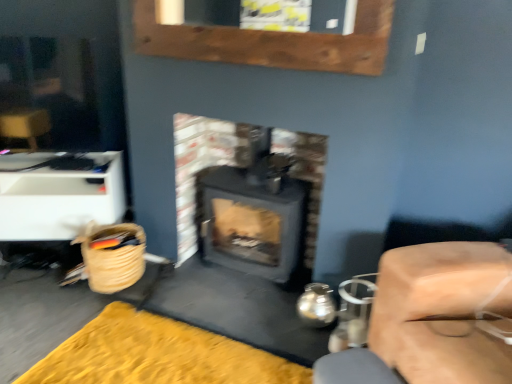
At what (x,y) coordinates should I click in order to perform the action: click on free space to the left of matte black wood burning stove at center. Please return your answer as a coordinate pair (x, y). The height and width of the screenshot is (384, 512). Looking at the image, I should click on (189, 286).